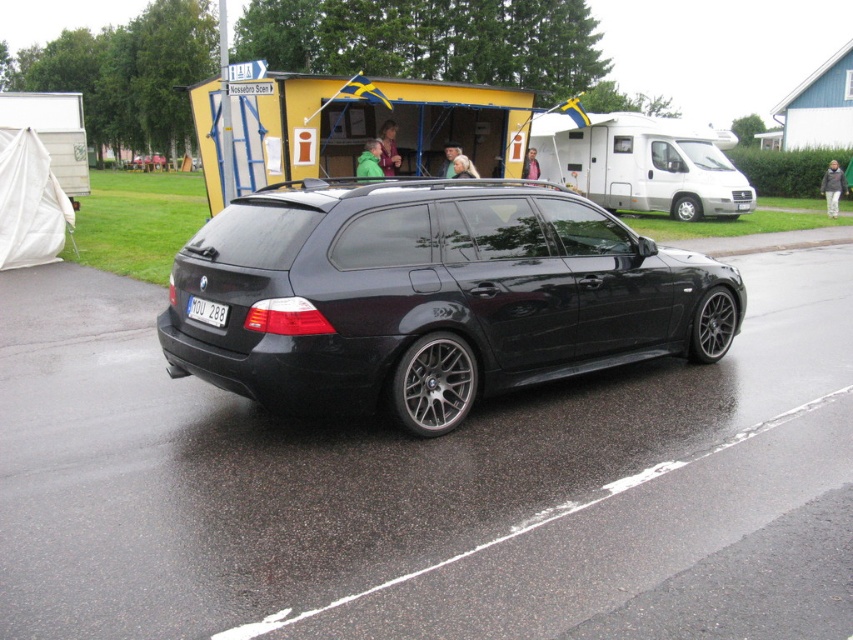
Is the position of yellow corrugated metal food truck at upper center more distant than that of green fabric jacket at center?

That is False.

Describe the element at coordinates (370, 125) in the screenshot. I see `yellow corrugated metal food truck at upper center` at that location.

Find the location of a particular element. The height and width of the screenshot is (640, 853). yellow corrugated metal food truck at upper center is located at coordinates (370, 125).

Which is more to the left, green fabric jacket at center or green matte jacket at center?

green matte jacket at center is more to the left.

Who is more distant from viewer, (393,157) or (363,170)?

Point (393,157)

What are the coordinates of `green fabric jacket at center` in the screenshot? It's located at (387, 148).

Between black metallic car at center and green matte jacket at center, which one appears on the right side from the viewer's perspective?

From the viewer's perspective, black metallic car at center appears more on the right side.

Does black metallic car at center have a greater width compared to green matte jacket at center?

Yes.

What are the coordinates of `black metallic car at center` in the screenshot? It's located at (431, 296).